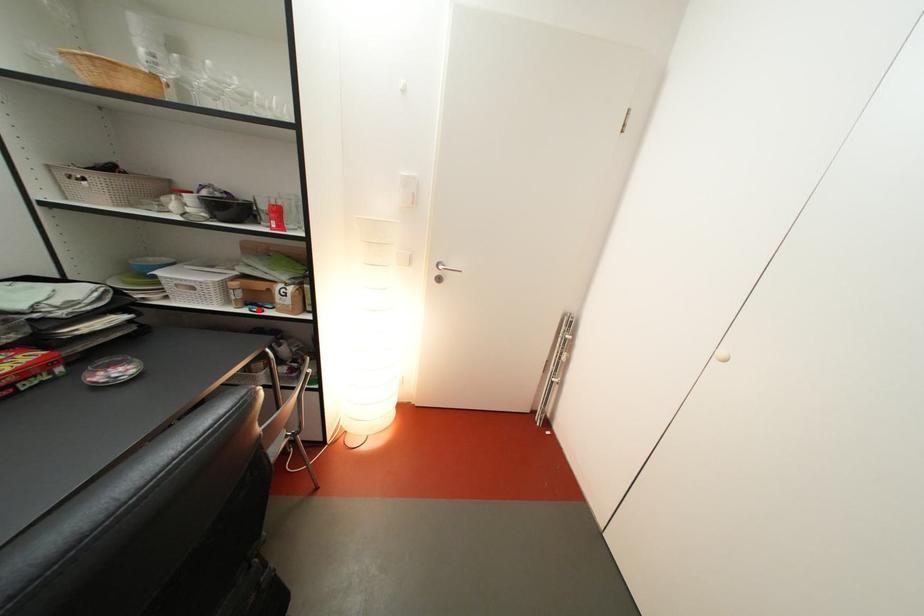
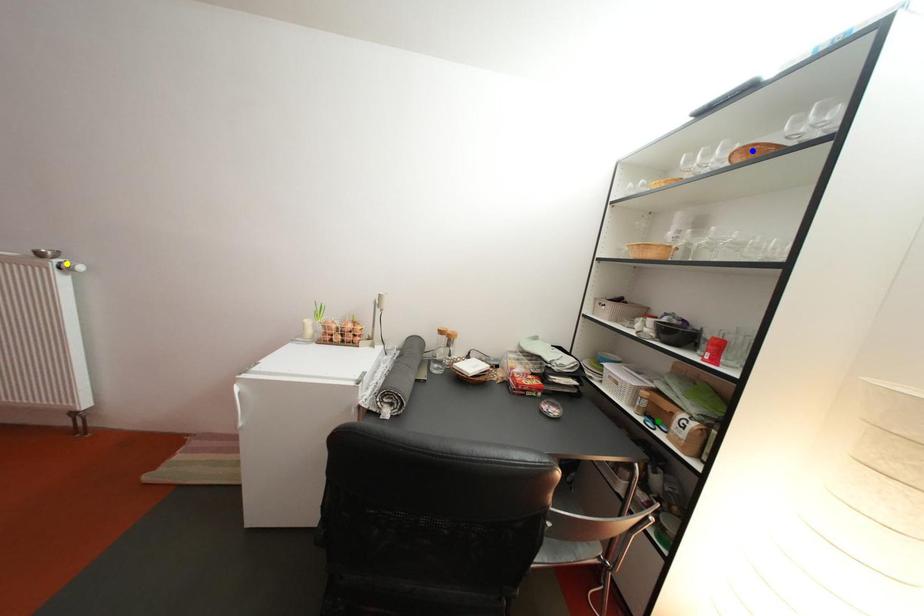
Question: I am providing you with two images of the same scene from different viewpoints. A red point is marked on the first image. You are given multiple points on the second image. In image 2, which mark is for the same physical point as the one in image 1?

Choices:
 (A) yellow point
 (B) blue point
 (C) green point

Answer: (C)